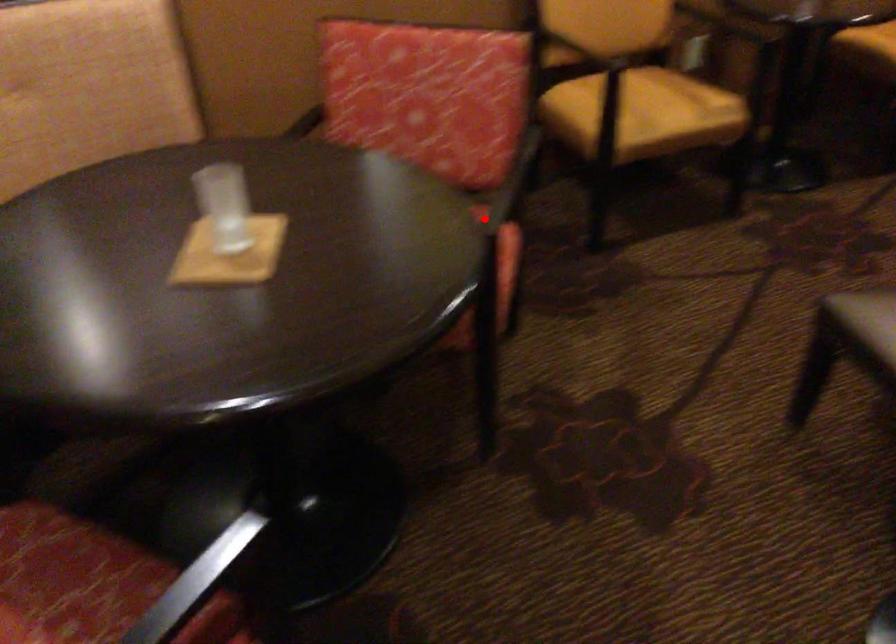
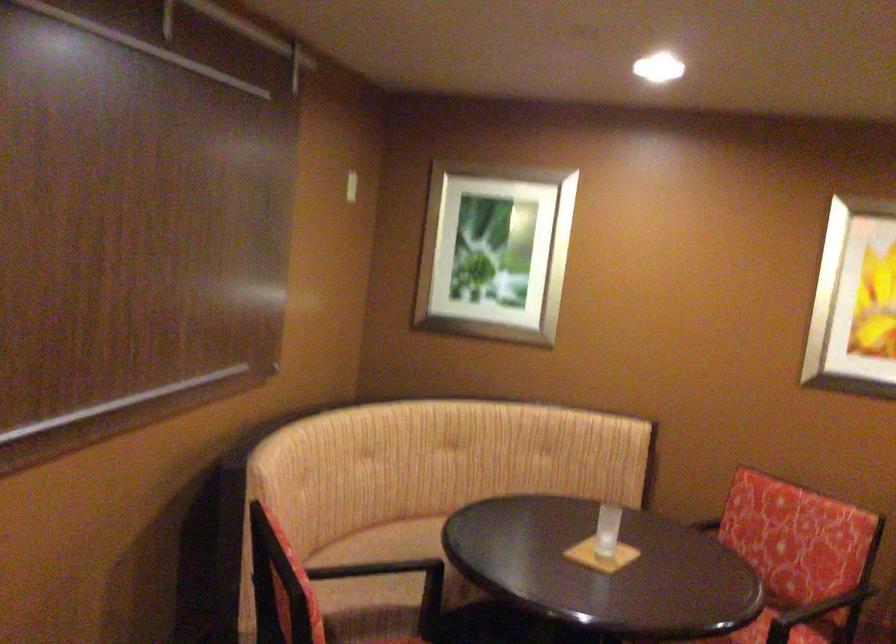
Where in the second image is the point corresponding to the highlighted location from the first image?

(779, 630)